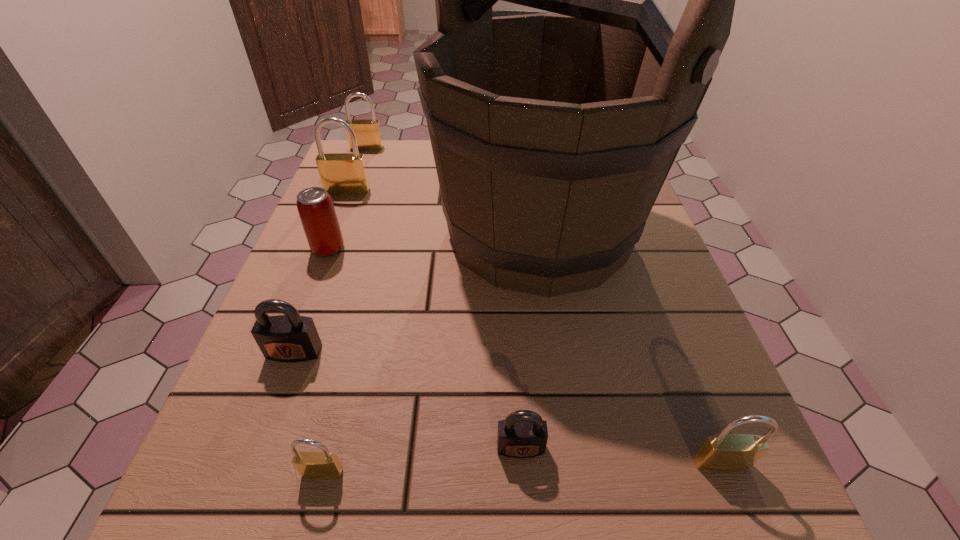
Locate an element on the screen. The width and height of the screenshot is (960, 540). the second padlock from right to left is located at coordinates (523, 434).

Find the location of a particular element. The image size is (960, 540). the smaller gray padlock is located at coordinates (523, 434).

At what (x,y) coordinates should I click in order to perform the action: click on the third padlock from right to left. Please return your answer as a coordinate pair (x, y). This screenshot has height=540, width=960. Looking at the image, I should click on (310, 465).

Image resolution: width=960 pixels, height=540 pixels. Find the location of `the third brass padlock from left to right`. the third brass padlock from left to right is located at coordinates (310, 465).

Image resolution: width=960 pixels, height=540 pixels. In order to click on vacant space situated on the left of the bucket in this screenshot , I will do `click(397, 232)`.

The image size is (960, 540). Identify the location of free spot located 0.340m on the front-facing side of the tallest padlock. (305, 299).

Identify the location of vacant area situated 0.100m on the front-facing side of the third smallest brass padlock. click(x=359, y=169).

Where is `free space located 0.150m on the front of the beer can`? The image size is (960, 540). free space located 0.150m on the front of the beer can is located at coordinates (302, 317).

Find the location of a particular element. This screenshot has height=540, width=960. free space located on the front of the left gray padlock near the keyhole is located at coordinates (273, 410).

In order to click on vacant space located on the front-facing side of the rightmost brass padlock in this screenshot , I will do `click(741, 513)`.